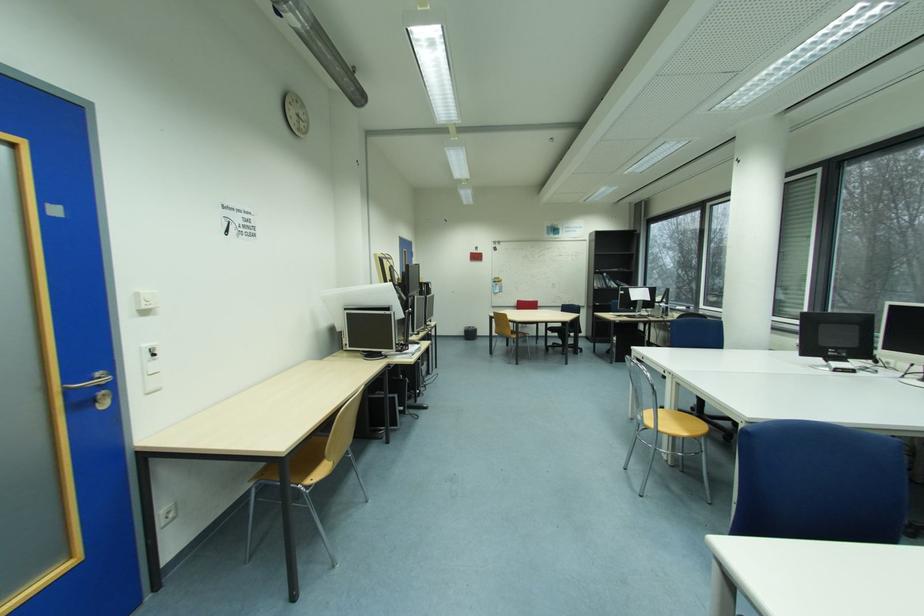
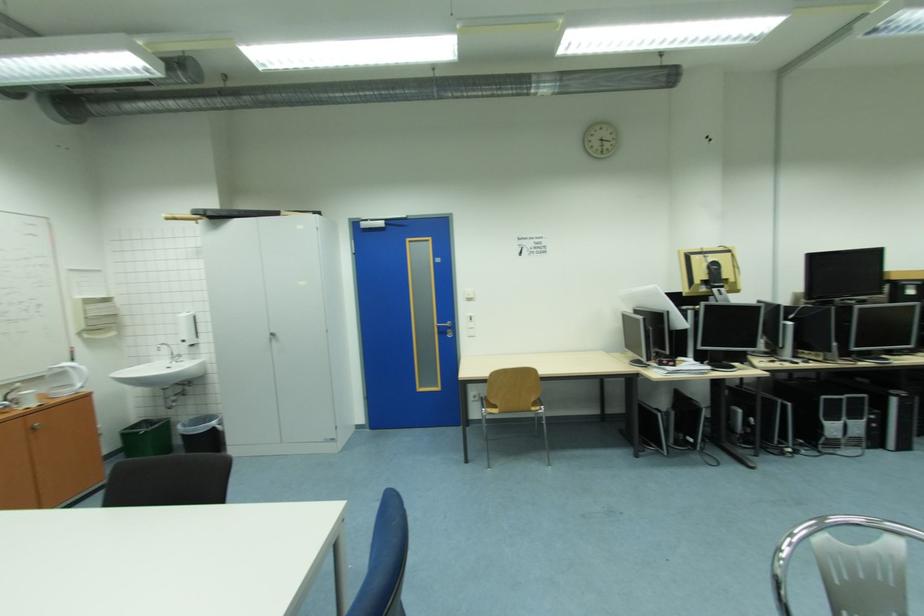
Where in the second image is the point corresponding to (x=152, y=313) from the first image?

(477, 301)